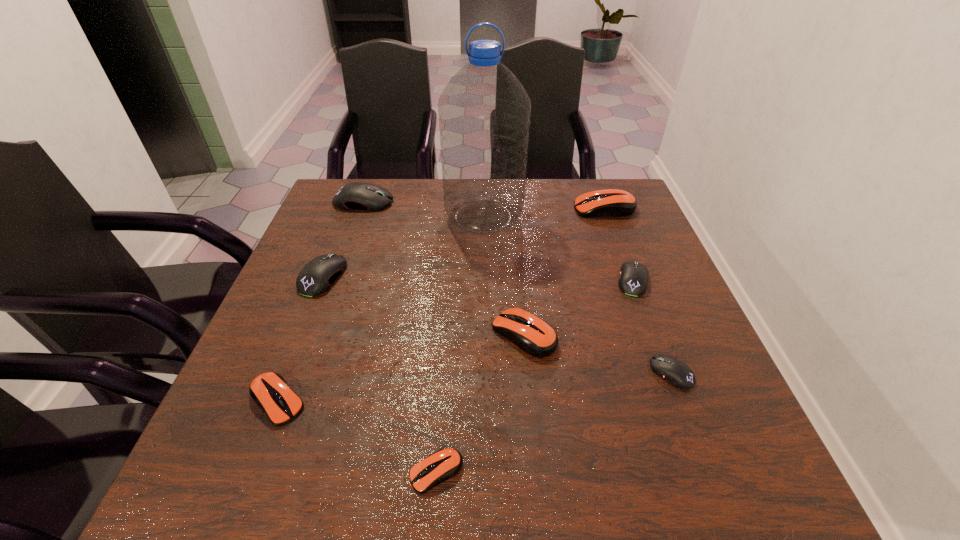
Find the location of a particular element. The image size is (960, 540). vacant position at the right edge of the desktop is located at coordinates (700, 420).

I want to click on vacant position at the far left corner of the desktop, so click(x=366, y=219).

The height and width of the screenshot is (540, 960). In the image, there is a desktop. Find the location of `vacant space at the near right corner`. vacant space at the near right corner is located at coordinates (711, 455).

Where is `free spot between the second biggest black computer equipment and the farthest black computer equipment`? free spot between the second biggest black computer equipment and the farthest black computer equipment is located at coordinates (344, 239).

At what (x,y) coordinates should I click in order to perform the action: click on vacant area that lies between the second smallest black computer equipment and the second biggest black computer equipment. Please return your answer as a coordinate pair (x, y). The height and width of the screenshot is (540, 960). Looking at the image, I should click on (478, 278).

Where is `vacant area that lies between the biggest black computer equipment and the smallest black computer equipment`? This screenshot has width=960, height=540. vacant area that lies between the biggest black computer equipment and the smallest black computer equipment is located at coordinates (517, 287).

You are a GUI agent. You are given a task and a screenshot of the screen. Output one action in this format:
    pyautogui.click(x=<x>, y=<y>)
    Task: Click on the free space between the leftmost orange computer mouse and the third smallest black computer equipment
    The image size is (960, 540).
    Given the screenshot: What is the action you would take?
    pyautogui.click(x=300, y=339)

This screenshot has width=960, height=540. In order to click on vacant area that lies between the nearest computer mouse and the second smallest black computer equipment in this screenshot , I will do `click(535, 376)`.

The height and width of the screenshot is (540, 960). Identify the location of vacant area between the second nearest orange computer mouse and the second orange computer mouse from right to left. coord(400,368).

Find the location of a particular element. free spot between the nearest black computer equipment and the farthest black computer equipment is located at coordinates (517, 287).